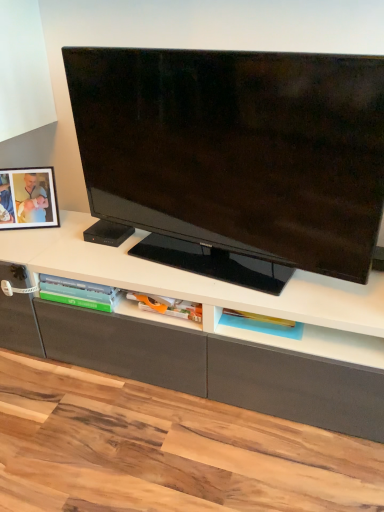
Question: From a real-world perspective, is matte black picture frame at left beneath matte black tv at center?

Choices:
 (A) no
 (B) yes

Answer: (B)

Question: Is matte black picture frame at left not near matte black tv at center?

Choices:
 (A) yes
 (B) no

Answer: (B)

Question: Considering the relative sizes of matte black picture frame at left and matte black tv at center in the image provided, is matte black picture frame at left smaller than matte black tv at center?

Choices:
 (A) yes
 (B) no

Answer: (A)

Question: Can you confirm if matte black picture frame at left is wider than matte black tv at center?

Choices:
 (A) yes
 (B) no

Answer: (B)

Question: Is matte black picture frame at left shorter than matte black tv at center?

Choices:
 (A) yes
 (B) no

Answer: (A)

Question: Is matte black picture frame at left thinner than matte black tv at center?

Choices:
 (A) no
 (B) yes

Answer: (B)

Question: Can you confirm if translucent plastic tray at lower center is positioned to the right of matte black picture frame at left?

Choices:
 (A) yes
 (B) no

Answer: (A)

Question: Is translucent plastic tray at lower center surrounding matte black picture frame at left?

Choices:
 (A) no
 (B) yes

Answer: (A)

Question: From a real-world perspective, is translucent plastic tray at lower center physically below matte black picture frame at left?

Choices:
 (A) no
 (B) yes

Answer: (B)

Question: Can you confirm if translucent plastic tray at lower center is bigger than matte black picture frame at left?

Choices:
 (A) no
 (B) yes

Answer: (A)

Question: Could you tell me if translucent plastic tray at lower center is turned towards matte black picture frame at left?

Choices:
 (A) no
 (B) yes

Answer: (A)

Question: From the image's perspective, does translucent plastic tray at lower center appear higher than matte black picture frame at left?

Choices:
 (A) yes
 (B) no

Answer: (B)

Question: Is translucent plastic tray at lower center beside matte black tv at center?

Choices:
 (A) no
 (B) yes

Answer: (A)